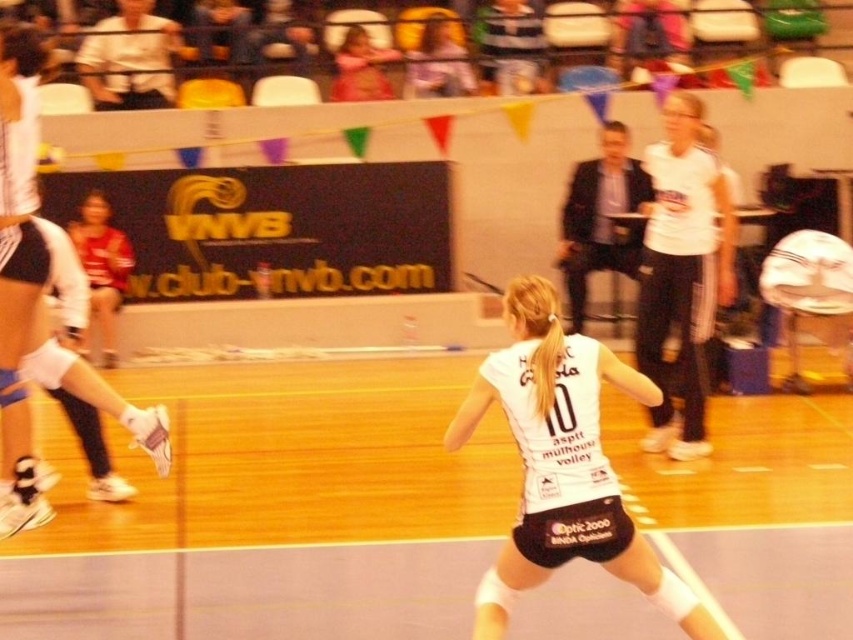
In the scene shown: Who is more forward, [10,486] or [347,88]?

Point [10,486]

Does white matte shorts at lower left come in front of pink fabric at upper center?

Yes, it is in front of pink fabric at upper center.

This screenshot has width=853, height=640. Identify the location of white matte shorts at lower left. (38, 298).

Locate an element on the screen. white matte shorts at lower left is located at coordinates (38, 298).

How far apart are white matte shorts at lower left and matte white jersey at center?

white matte shorts at lower left and matte white jersey at center are 9.94 meters apart.

Who is positioned more to the left, white matte shorts at lower left or matte white jersey at center?

Positioned to the left is white matte shorts at lower left.

Where is `white matte shorts at lower left`? The height and width of the screenshot is (640, 853). white matte shorts at lower left is located at coordinates (38, 298).

Does point (454, 93) come behind point (354, 70)?

Yes.

Between matte white jersey at center and pink fabric at upper center, which one has less height?

matte white jersey at center is shorter.

Where is `matte white jersey at center`? matte white jersey at center is located at coordinates (438, 64).